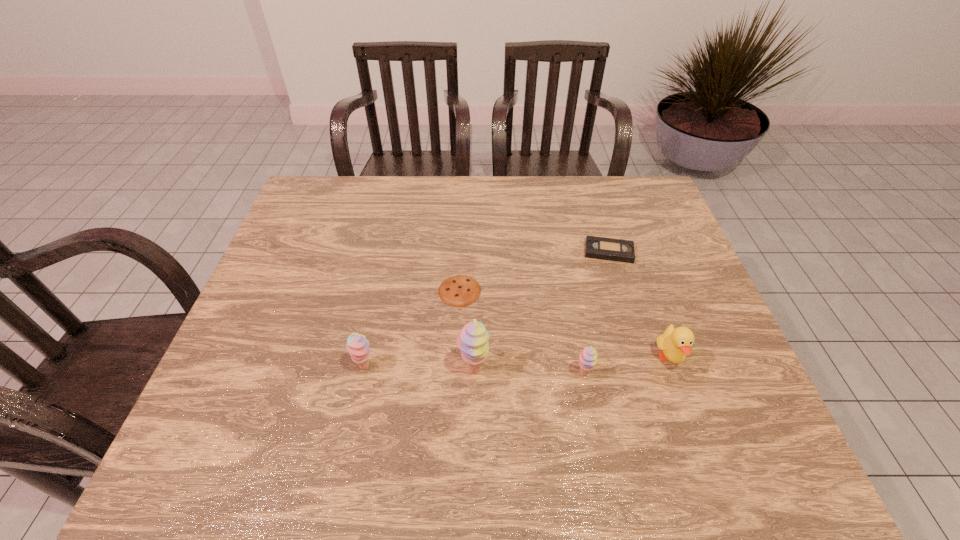
The height and width of the screenshot is (540, 960). I want to click on the leftmost object, so click(x=357, y=345).

You are a GUI agent. You are given a task and a screenshot of the screen. Output one action in this format:
    pyautogui.click(x=<x>, y=<y>)
    Task: Click on the leftmost sherbert
    The height and width of the screenshot is (540, 960).
    Given the screenshot: What is the action you would take?
    pyautogui.click(x=357, y=345)

Locate an element on the screen. The height and width of the screenshot is (540, 960). the tallest sherbert is located at coordinates (472, 341).

Identify the location of the second sherbert from left to right. This screenshot has width=960, height=540. (472, 341).

Identify the location of the shortest sherbert. The height and width of the screenshot is (540, 960). pyautogui.click(x=588, y=357).

In order to click on the third object from right to left in this screenshot , I will do `click(588, 357)`.

This screenshot has height=540, width=960. I want to click on duckling, so click(675, 343).

I want to click on the fifth tallest object, so click(602, 248).

This screenshot has width=960, height=540. Find the location of `the farthest object`. the farthest object is located at coordinates (602, 248).

At what (x,y) coordinates should I click in order to perform the action: click on the fifth nearest object. Please return your answer as a coordinate pair (x, y). This screenshot has height=540, width=960. Looking at the image, I should click on tap(460, 290).